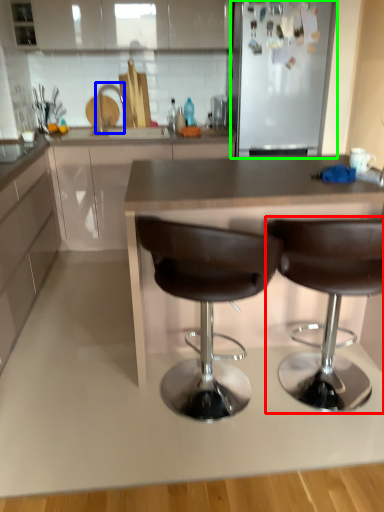
Question: Based on their relative distances, which object is nearer to chair (highlighted by a red box)? Choose from silver (highlighted by a blue box) and appliance (highlighted by a green box).

Choices:
 (A) silver
 (B) appliance

Answer: (B)